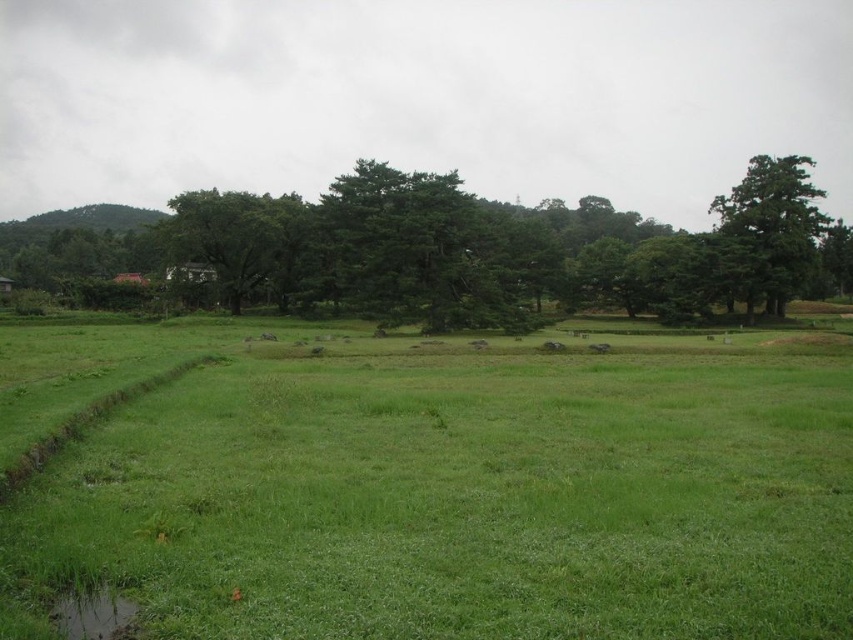
Based on the photo, you are a hiker who wants to take a photo of the green leafy tree at left and the green grassy puddle at lower left. Which object should you focus on first if you want both to be in focus without moving your camera position?

The green leafy tree at left is closer to the camera than the green grassy puddle at lower left, so you should focus on the green leafy tree at left first to ensure both are in focus.

You are standing at the center of the grassy field and want to walk towards the green leafy tree at left. Based on the coordinates provided in the Objects Description, in which general direction should you head?

The green leafy tree at left is located at point coordinates of 0.375 on the x axis and 0.284 on the y axis. Since the coordinates are less than 0.5 in both axes, it means the tree is positioned to the left and lower part of the image. Therefore, you should head towards the left and slightly downward direction from your current position at the center to reach the tree.

You are standing in the middle of the field and want to take a photo of the green leafy tree at center. Your camera has a maximum focus range of 50 meters. Will you be able to focus on the tree?

The green leafy tree at center is 54.11 meters away from the viewer. Since the camera can only focus up to 50 meters, it won cannot focus on the tree.